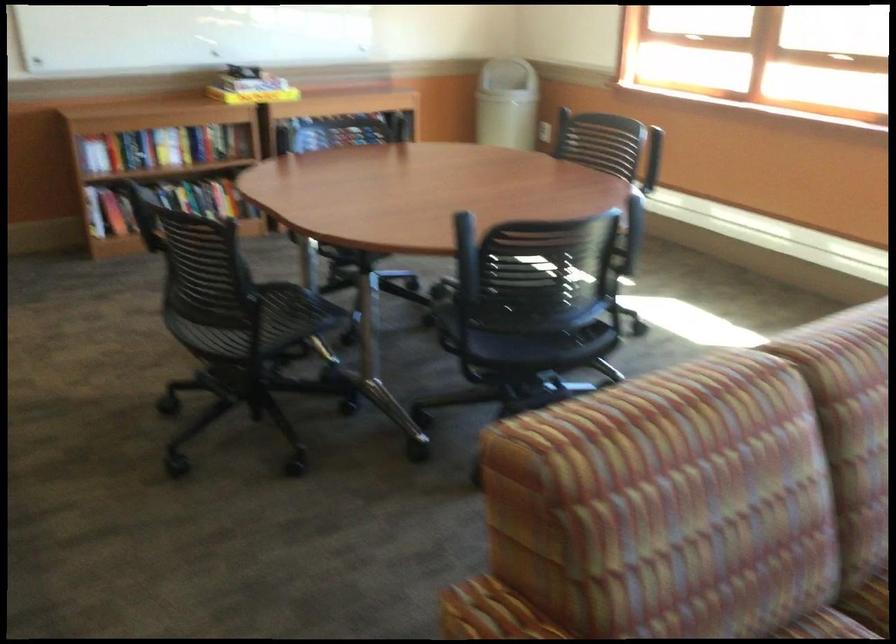
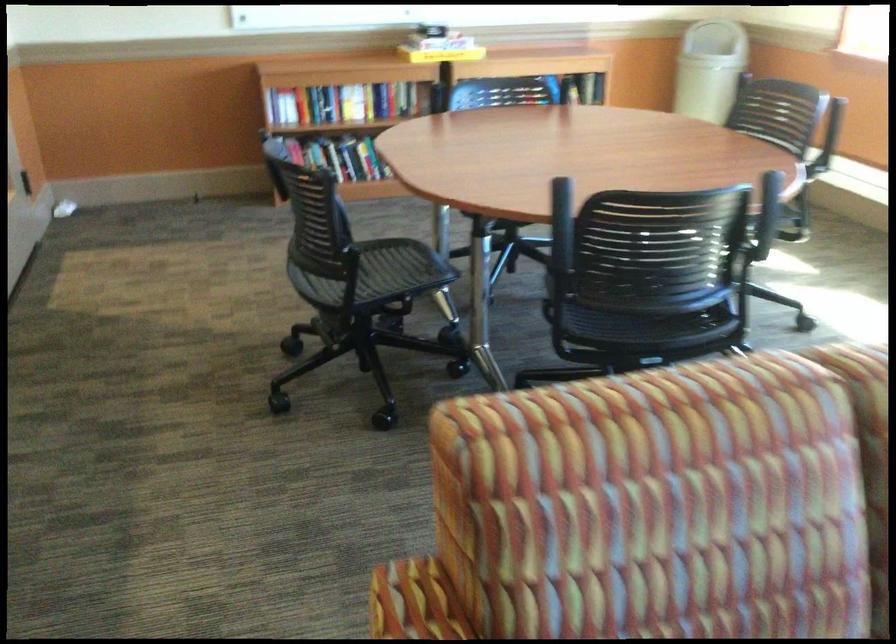
Question: The camera is either moving clockwise (left) or counter-clockwise (right) around the object. The first image is from the beginning of the video and the second image is from the end. Is the camera moving left or right when shooting the video?

Choices:
 (A) Left
 (B) Right

Answer: (B)